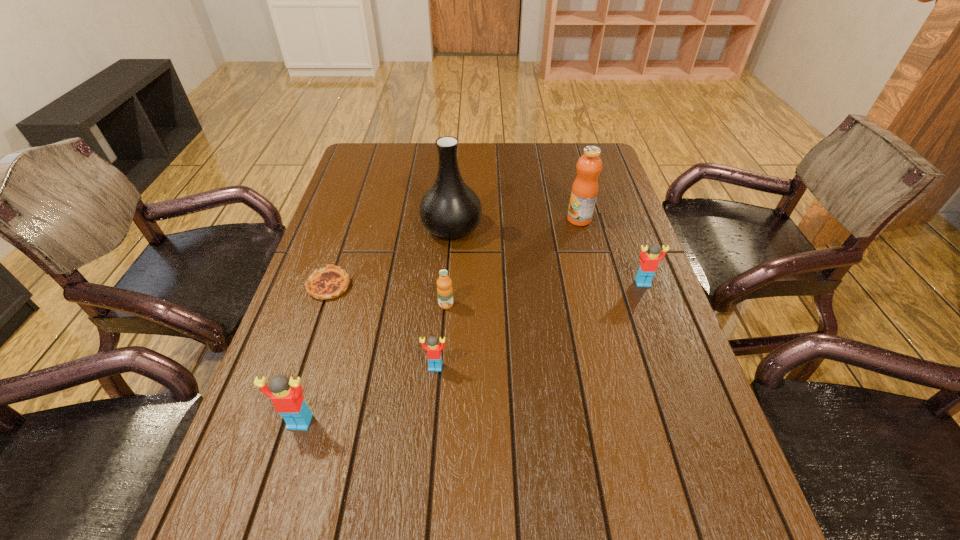
The image size is (960, 540). In order to click on Lego that is at the right edge in this screenshot , I will do `click(649, 262)`.

Find the location of a particular element. Image resolution: width=960 pixels, height=540 pixels. fruit juice that is positioned at the right edge is located at coordinates (584, 191).

This screenshot has height=540, width=960. I want to click on vacant space at the far edge of the desktop, so click(x=406, y=179).

Where is `free space at the near edge of the desktop`? free space at the near edge of the desktop is located at coordinates (494, 461).

Image resolution: width=960 pixels, height=540 pixels. In order to click on vacant space at the left edge of the desktop in this screenshot , I will do `click(329, 318)`.

Locate an element on the screen. The width and height of the screenshot is (960, 540). free point at the right edge is located at coordinates (656, 350).

The width and height of the screenshot is (960, 540). I want to click on vacant space at the near left corner of the desktop, so click(x=262, y=469).

In the image, there is a desktop. At what (x,y) coordinates should I click in order to perform the action: click on vacant space at the far right corner. Please return your answer as a coordinate pair (x, y). Looking at the image, I should click on (578, 145).

Find the location of `vacant point located between the fifth shortest object and the sixth farthest object`. vacant point located between the fifth shortest object and the sixth farthest object is located at coordinates (368, 394).

The image size is (960, 540). I want to click on empty space between the quiche and the fifth shortest object, so click(314, 354).